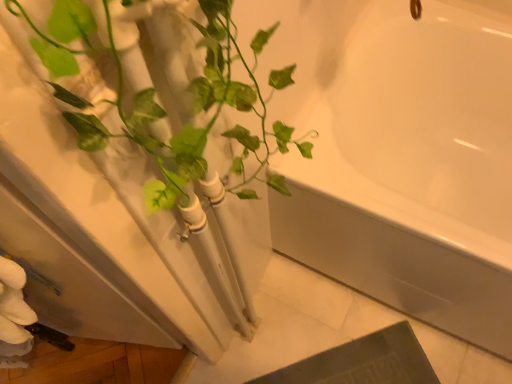
Measure the distance between green glossy plant at left and camera.

They are 9.80 inches apart.

The image size is (512, 384). I want to click on green glossy plant at left, so click(x=192, y=115).

From the picture: In order to face green glossy plant at left, should I rotate leftwards or rightwards?

It's best to rotate left around 0.274 degrees.

This screenshot has height=384, width=512. What do you see at coordinates (192, 115) in the screenshot?
I see `green glossy plant at left` at bounding box center [192, 115].

The image size is (512, 384). In order to click on white glossy bathtub at upper right in this screenshot , I will do click(410, 164).

Describe the element at coordinates (410, 164) in the screenshot. I see `white glossy bathtub at upper right` at that location.

Find the location of `green glossy plant at left`. green glossy plant at left is located at coordinates (192, 115).

Can you confirm if white glossy bathtub at upper right is positioned to the left of green glossy plant at left?

No.

Considering the relative positions of white glossy bathtub at upper right and green glossy plant at left in the image provided, is white glossy bathtub at upper right in front of green glossy plant at left?

That is False.

Consider the image. Which is closer to the camera, (293, 229) or (257, 41)?

Clearly, point (293, 229) is more distant from the camera than point (257, 41).

From the image's perspective, is white glossy bathtub at upper right under green glossy plant at left?

No, from the image's perspective, white glossy bathtub at upper right is not beneath green glossy plant at left.

From a real-world perspective, between white glossy bathtub at upper right and green glossy plant at left, who is vertically lower?

white glossy bathtub at upper right.

Considering the sizes of objects white glossy bathtub at upper right and green glossy plant at left in the image provided, who is wider, white glossy bathtub at upper right or green glossy plant at left?

white glossy bathtub at upper right is wider.

Considering the relative sizes of white glossy bathtub at upper right and green glossy plant at left in the image provided, is white glossy bathtub at upper right shorter than green glossy plant at left?

Yes, white glossy bathtub at upper right is shorter than green glossy plant at left.

Considering the sizes of objects white glossy bathtub at upper right and green glossy plant at left in the image provided, who is smaller, white glossy bathtub at upper right or green glossy plant at left?

green glossy plant at left is smaller.

Is white glossy bathtub at upper right spatially inside green glossy plant at left, or outside of it?

white glossy bathtub at upper right is not inside green glossy plant at left, it's outside.

Is white glossy bathtub at upper right beside green glossy plant at left?

No, white glossy bathtub at upper right is not beside green glossy plant at left.

Is white glossy bathtub at upper right facing away from green glossy plant at left?

No, white glossy bathtub at upper right is not facing the opposite direction of green glossy plant at left.

Locate an element on the screen. houseplant below the white glossy bathtub at upper right (from the image's perspective) is located at coordinates (192, 115).

Considering the positions of objects green glossy plant at left and white glossy bathtub at upper right in the image provided, who is more to the left, green glossy plant at left or white glossy bathtub at upper right?

From the viewer's perspective, green glossy plant at left appears more on the left side.

Considering the positions of objects green glossy plant at left and white glossy bathtub at upper right in the image provided, who is behind, green glossy plant at left or white glossy bathtub at upper right?

white glossy bathtub at upper right is further from the camera.

Is point (225, 72) in front of point (503, 267)?

Yes, point (225, 72) is in front of point (503, 267).

From the image's perspective, is green glossy plant at left located above or below white glossy bathtub at upper right?

From the image's perspective, green glossy plant at left appears below white glossy bathtub at upper right.

From a real-world perspective, is green glossy plant at left positioned under white glossy bathtub at upper right based on gravity?

No, from a real-world perspective, green glossy plant at left is not below white glossy bathtub at upper right.

Between green glossy plant at left and white glossy bathtub at upper right, which one has smaller width?

Thinner between the two is green glossy plant at left.

Which of these two, green glossy plant at left or white glossy bathtub at upper right, stands shorter?

Standing shorter between the two is white glossy bathtub at upper right.

Considering the sizes of objects green glossy plant at left and white glossy bathtub at upper right in the image provided, who is smaller, green glossy plant at left or white glossy bathtub at upper right?

With smaller size is green glossy plant at left.

Is white glossy bathtub at upper right a part of green glossy plant at left?

No.

Consider the image. Is green glossy plant at left not close to white glossy bathtub at upper right?

No, there isn't a large distance between green glossy plant at left and white glossy bathtub at upper right.

Consider the image. Is green glossy plant at left facing towards white glossy bathtub at upper right?

No.

How different are the orientations of green glossy plant at left and white glossy bathtub at upper right in degrees?

90 degrees.

I want to click on bathtub that appears above the green glossy plant at left (from the image's perspective), so tap(410, 164).

The image size is (512, 384). I want to click on bathtub behind the green glossy plant at left, so click(x=410, y=164).

This screenshot has width=512, height=384. What are the coordinates of `bathtub above the green glossy plant at left (from the image's perspective)` in the screenshot? It's located at (410, 164).